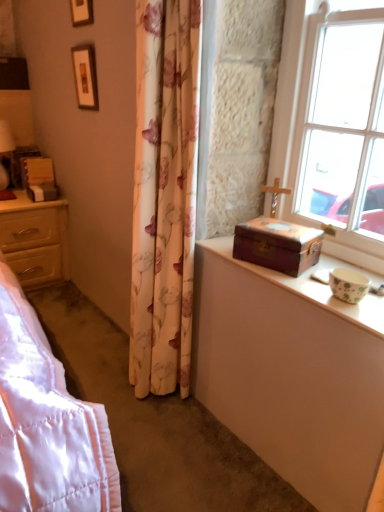
Where is `vacant area in front of wooden treasure chest at window sill`? This screenshot has width=384, height=512. vacant area in front of wooden treasure chest at window sill is located at coordinates [290, 282].